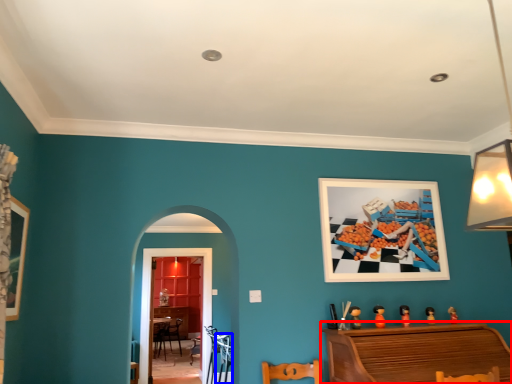
Question: Which object appears farthest to the camera in this image, furniture (highlighted by a red box) or armchair (highlighted by a blue box)?

Choices:
 (A) furniture
 (B) armchair

Answer: (B)